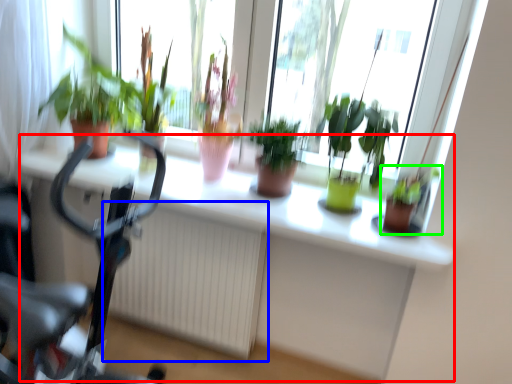
Question: Considering the real-world distances, which object is farthest from computer desk (highlighted by a red box)? radiator (highlighted by a blue box) or houseplant (highlighted by a green box)?

Choices:
 (A) radiator
 (B) houseplant

Answer: (B)